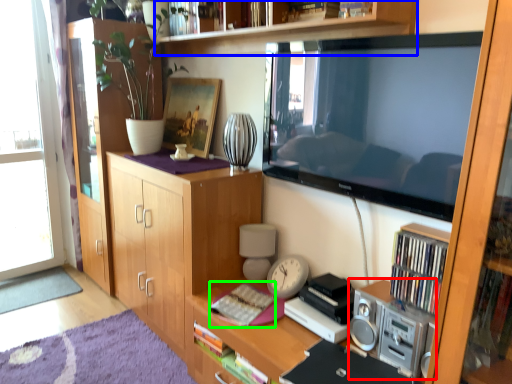
Question: Estimate the real-world distances between objects in this image. Which object is farther from stereo (highlighted by a red box), shelf (highlighted by a blue box) or book (highlighted by a green box)?

Choices:
 (A) shelf
 (B) book

Answer: (A)